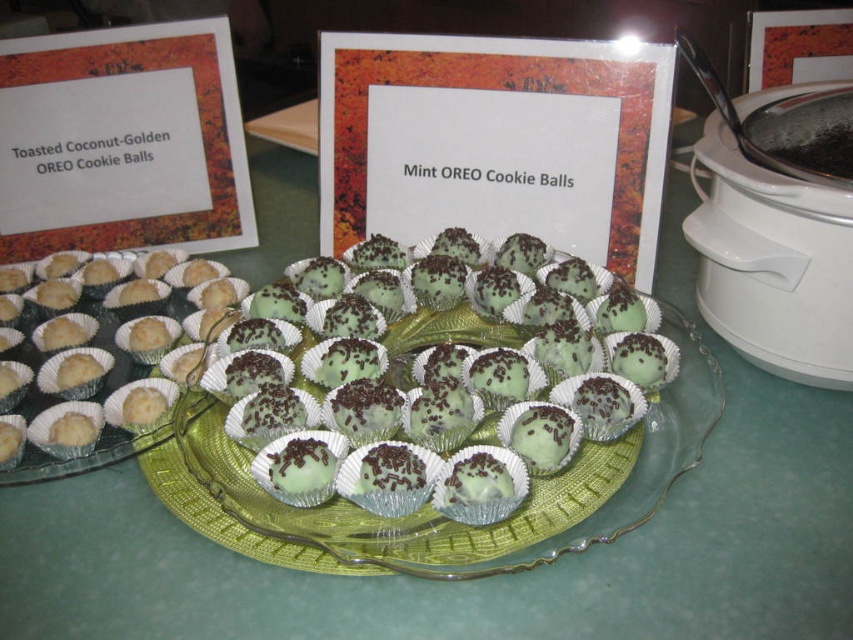
Can you confirm if mint chocolate cookie balls at center is taller than white matte muffin at left?

Yes.

Who is more distant from viewer, (299, 300) or (225, 310)?

The point (225, 310) is more distant.

You are a GUI agent. You are given a task and a screenshot of the screen. Output one action in this format:
    pyautogui.click(x=<x>, y=<y>)
    Task: Click on the mint chocolate cookie balls at center
    The image size is (853, 640).
    Given the screenshot: What is the action you would take?
    pyautogui.click(x=433, y=376)